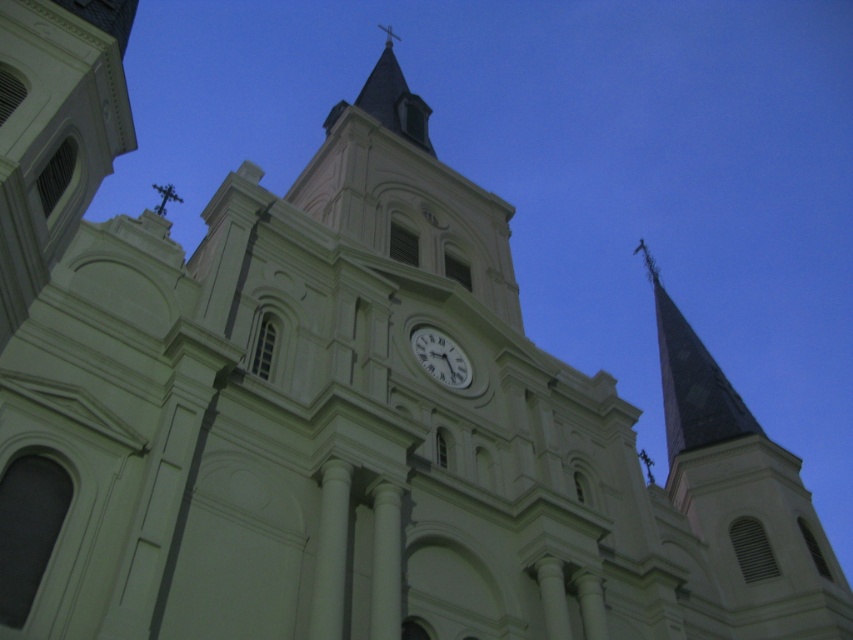
Question: Among these objects, which one is nearest to the camera?

Choices:
 (A) white glossy clock at center
 (B) smooth gray steeple at right
 (C) dark gray slate spire at upper right

Answer: (B)

Question: Which object is the closest to the dark gray slate spire at upper right?

Choices:
 (A) white glossy clock at center
 (B) smooth gray steeple at right

Answer: (B)

Question: From the image, what is the correct spatial relationship of smooth gray steeple at right in relation to dark gray slate spire at upper right?

Choices:
 (A) above
 (B) below

Answer: (A)

Question: Can you confirm if smooth gray steeple at right is smaller than white glossy clock at center?

Choices:
 (A) yes
 (B) no

Answer: (B)

Question: Among these points, which one is farthest from the camera?

Choices:
 (A) (712, 413)
 (B) (462, 388)

Answer: (A)

Question: Does dark gray slate spire at upper right appear on the right side of white glossy clock at center?

Choices:
 (A) yes
 (B) no

Answer: (A)